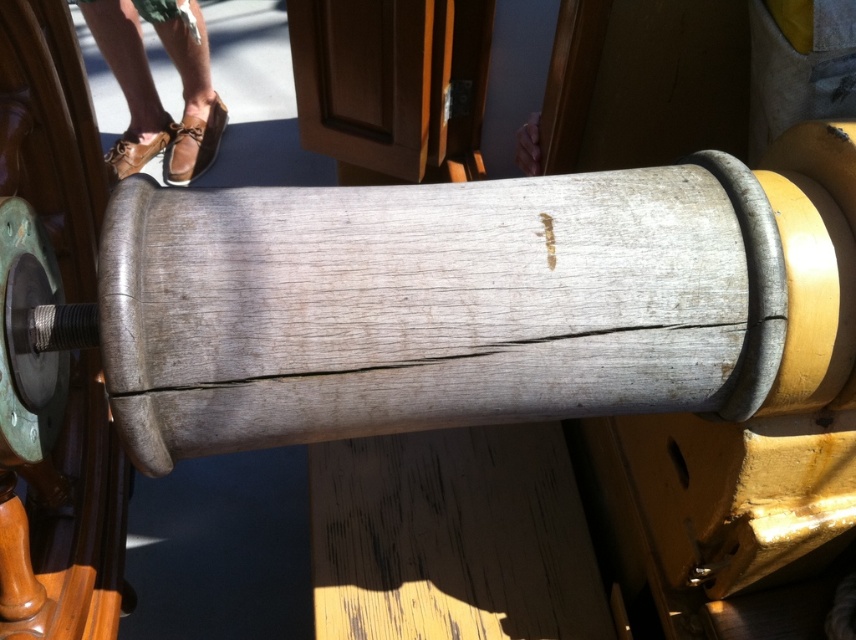
Question: Can you confirm if green patina metal at left is positioned to the left of brown leather shoes at upper left?

Choices:
 (A) yes
 (B) no

Answer: (B)

Question: Which point appears farthest from the camera in this image?

Choices:
 (A) (159, 141)
 (B) (82, 429)

Answer: (A)

Question: Is green patina metal at left closer to the viewer compared to brown leather shoes at upper left?

Choices:
 (A) no
 (B) yes

Answer: (B)

Question: Does green patina metal at left have a smaller size compared to brown leather shoes at upper left?

Choices:
 (A) no
 (B) yes

Answer: (B)